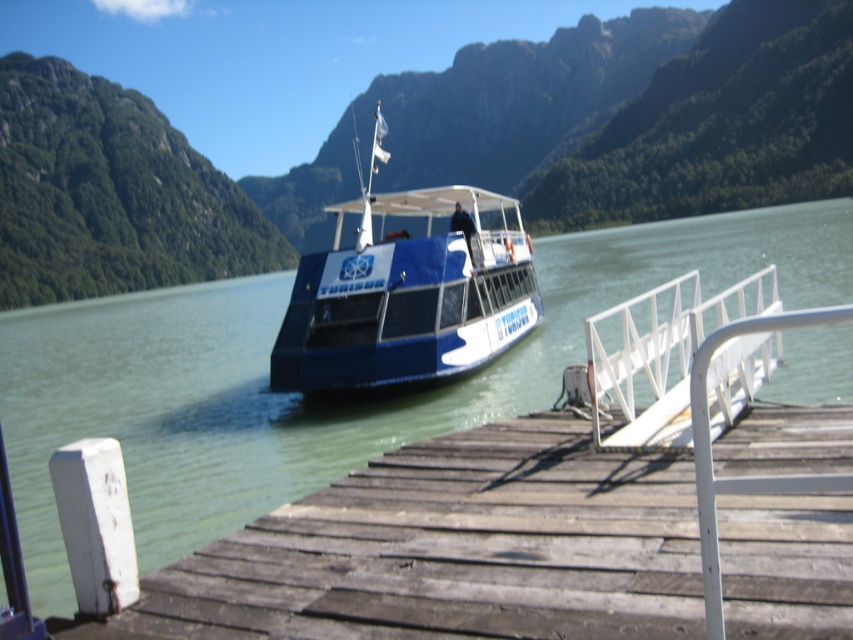
Which is below, blue glossy boat at center or green textured mountain at upper left?

blue glossy boat at center is below.

Does blue glossy boat at center have a greater height compared to green textured mountain at upper left?

In fact, blue glossy boat at center may be shorter than green textured mountain at upper left.

Does point (817, 401) come in front of point (120, 129)?

Yes, it is in front of point (120, 129).

This screenshot has width=853, height=640. Find the location of `blue glossy boat at center`. blue glossy boat at center is located at coordinates (x=323, y=404).

The image size is (853, 640). Describe the element at coordinates (323, 404) in the screenshot. I see `blue glossy boat at center` at that location.

Consider the image. Does blue glossy boat at center appear on the right side of white matte rail at center?

Incorrect, blue glossy boat at center is not on the right side of white matte rail at center.

Which is behind, point (793, 387) or point (769, 355)?

The point (793, 387) is more distant.

The height and width of the screenshot is (640, 853). Identify the location of blue glossy boat at center. (323, 404).

Consider the image. Who is more distant from viewer, (114, 145) or (300, 337)?

Positioned behind is point (114, 145).

In order to click on green textured mountain at upper left in this screenshot , I will do `click(109, 195)`.

Where is `green textured mountain at upper left`? The width and height of the screenshot is (853, 640). green textured mountain at upper left is located at coordinates (109, 195).